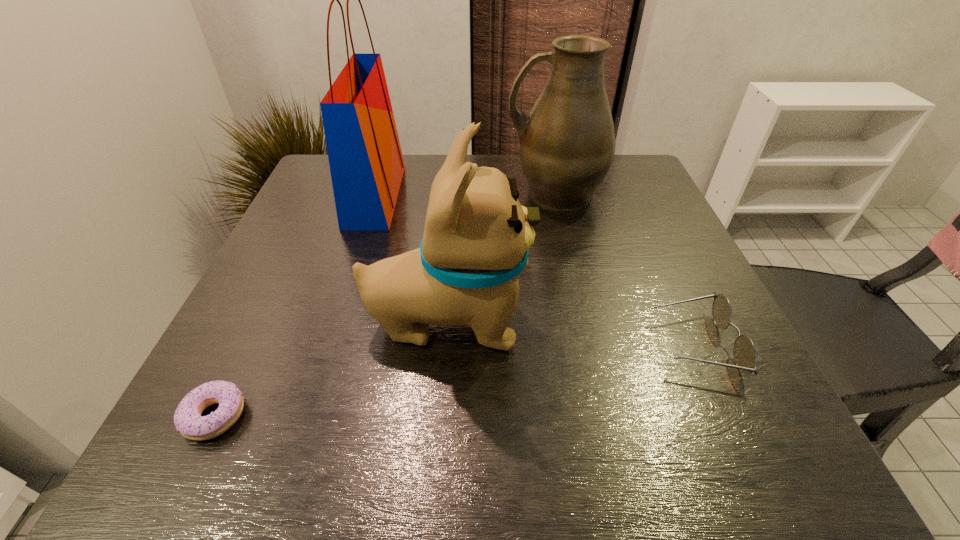
Locate an element on the screen. pitcher that is positioned at the right edge is located at coordinates pos(567,143).

Where is `spectacles present at the right edge`? The height and width of the screenshot is (540, 960). spectacles present at the right edge is located at coordinates (745, 355).

Where is `object located at the far left corner`? Image resolution: width=960 pixels, height=540 pixels. object located at the far left corner is located at coordinates (366, 163).

The height and width of the screenshot is (540, 960). I want to click on object situated at the near left corner, so click(x=187, y=418).

You are a GUI agent. You are given a task and a screenshot of the screen. Output one action in this format:
    pyautogui.click(x=<x>, y=<y>)
    Task: Click on the object that is at the far right corner
    
    Given the screenshot: What is the action you would take?
    pyautogui.click(x=567, y=143)

I want to click on free region at the far edge, so click(422, 190).

The width and height of the screenshot is (960, 540). Find the location of `vacant space at the near edge of the desktop`. vacant space at the near edge of the desktop is located at coordinates (503, 447).

The image size is (960, 540). I want to click on vacant space at the left edge of the desktop, so click(269, 355).

In the image, there is a desktop. Where is `vacant space at the right edge`? This screenshot has width=960, height=540. vacant space at the right edge is located at coordinates (629, 202).

The height and width of the screenshot is (540, 960). Find the location of `vacant position at the far right corner of the desktop`. vacant position at the far right corner of the desktop is located at coordinates (636, 190).